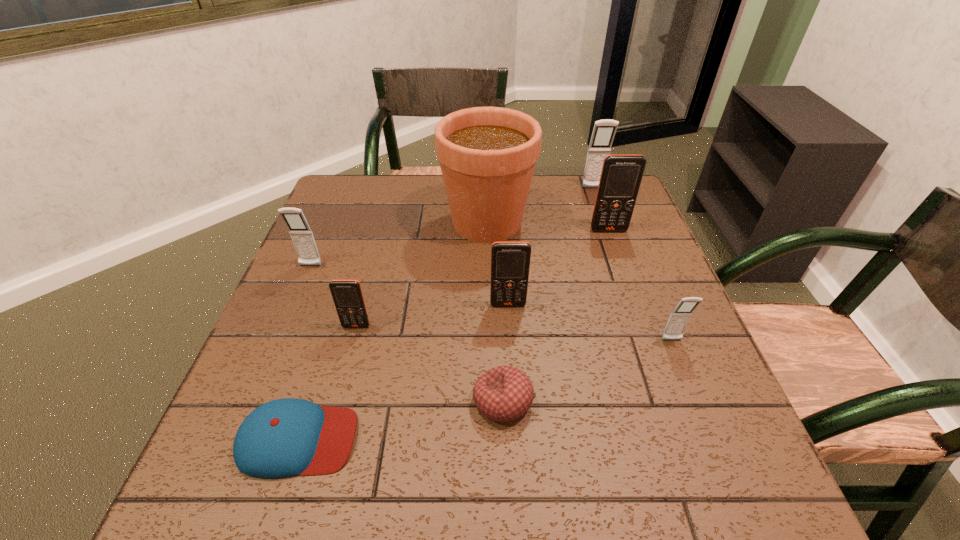
The width and height of the screenshot is (960, 540). Identify the location of vacant area that lies between the baseball cap and the leftmost orange cellular telephone. (327, 383).

Locate an element on the screen. empty space that is in between the nearest cellular telephone and the beanbag is located at coordinates (588, 370).

The height and width of the screenshot is (540, 960). I want to click on vacant area that lies between the leftmost gray cellular telephone and the farthest orange cellular telephone, so pos(460,248).

Identify which object is located as the sixth nearest to the fourth nearest object. Please provide its 2D coordinates. Your answer should be formatted as a tuple, i.e. [(x, y)], where the tuple contains the x and y coordinates of a point satisfying the conditions above.

[(679, 318)]

This screenshot has height=540, width=960. What are the coordinates of `the fourth closest object to the second gray cellular telephone from right to left` in the screenshot? It's located at (679, 318).

Locate an element on the screen. This screenshot has height=540, width=960. cellular telephone that is the second closest to the beanbag is located at coordinates (347, 295).

You are a GUI agent. You are given a task and a screenshot of the screen. Output one action in this format:
    pyautogui.click(x=<x>, y=<y>)
    Task: Click on the cellular telephone that can be found as the fifth closest to the biggest gray cellular telephone
    The image size is (960, 540).
    Given the screenshot: What is the action you would take?
    pyautogui.click(x=301, y=234)

You are a GUI agent. You are given a task and a screenshot of the screen. Output one action in this format:
    pyautogui.click(x=<x>, y=<y>)
    Task: Click on the closest gray cellular telephone to the farthest orange cellular telephone
    This screenshot has height=540, width=960.
    Given the screenshot: What is the action you would take?
    pyautogui.click(x=604, y=131)

The height and width of the screenshot is (540, 960). Identify the location of gray cellular telephone identified as the closest to the baseball cap. (301, 234).

The image size is (960, 540). In order to click on orange cellular telephone that can be found as the second closest to the second smallest orange cellular telephone in this screenshot , I will do `click(621, 175)`.